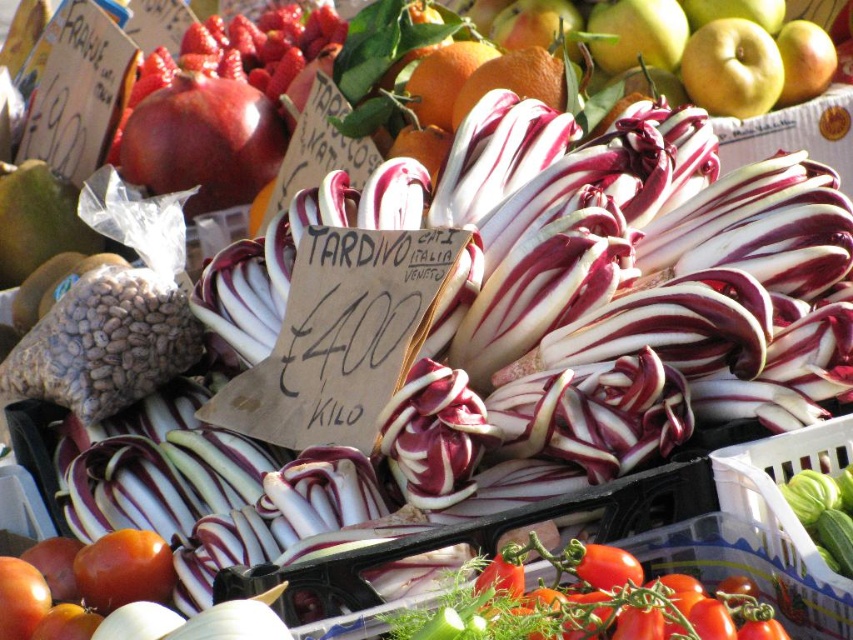
You are a customer at the market stall and want to buy both the green matte apple at upper right and the glossy red tomato at lower left. If you want to pick them up first, which one should you reach for first based on their positions?

The glossy red tomato at lower left is to the left of the green matte apple at upper right, so you should reach for the glossy red tomato at lower left first to pick them up in order from left to right.